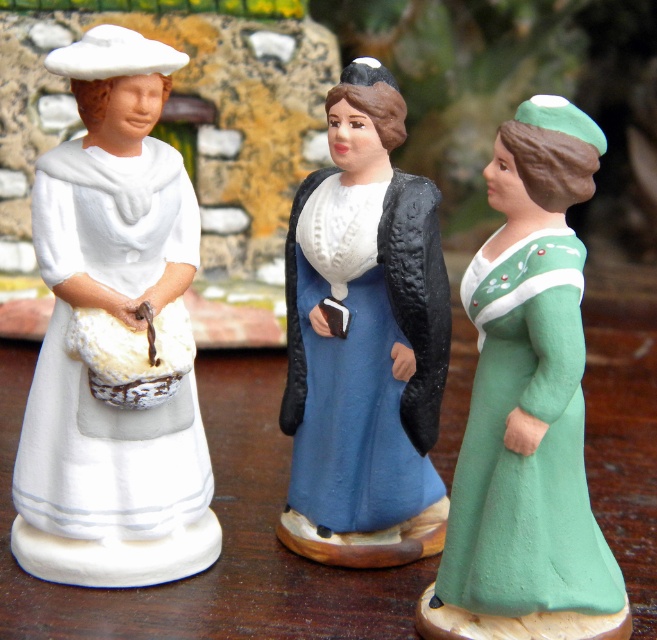
Question: Which object is positioned farthest from the green matte dress at center?

Choices:
 (A) blue matte dress at center
 (B) white matte porcelain figurine at left

Answer: (B)

Question: Which is nearer to the white matte porcelain figurine at left?

Choices:
 (A) blue matte dress at center
 (B) green matte dress at center

Answer: (A)

Question: Does green matte dress at center appear on the right side of blue matte dress at center?

Choices:
 (A) no
 (B) yes

Answer: (B)

Question: Is green matte dress at center to the left of blue matte dress at center from the viewer's perspective?

Choices:
 (A) no
 (B) yes

Answer: (A)

Question: Where is green matte dress at center located in relation to blue matte dress at center in the image?

Choices:
 (A) left
 (B) right

Answer: (B)

Question: Which of the following is the closest to the observer?

Choices:
 (A) (392, 256)
 (B) (170, 396)
 (C) (493, 486)

Answer: (C)